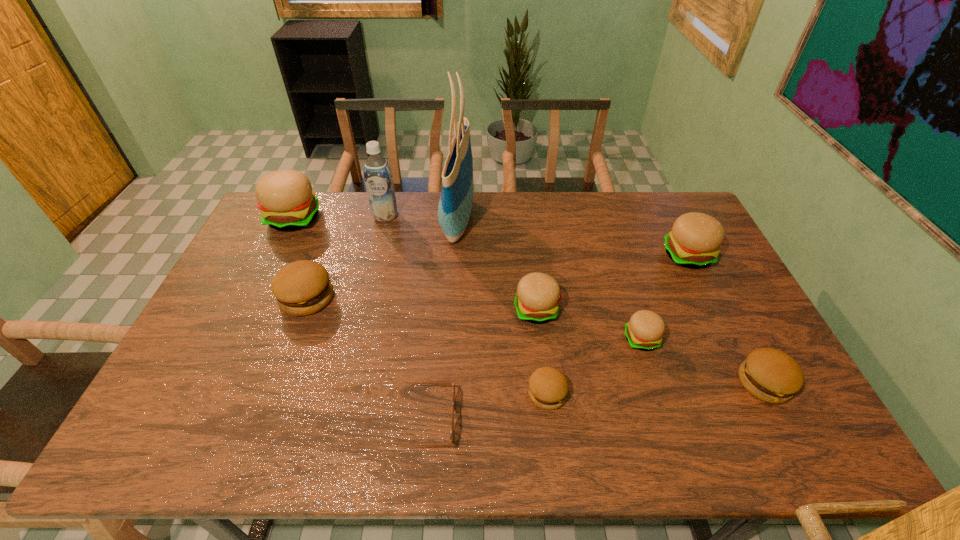
You are a GUI agent. You are given a task and a screenshot of the screen. Output one action in this format:
    pyautogui.click(x=<x>, y=<y>)
    Task: Click on the hamburger positioned at the far edge
    The width and height of the screenshot is (960, 540).
    Given the screenshot: What is the action you would take?
    pyautogui.click(x=286, y=201)

The width and height of the screenshot is (960, 540). I want to click on object present at the near edge, so click(x=437, y=383).

You are a GUI agent. You are given a task and a screenshot of the screen. Output one action in this format:
    pyautogui.click(x=<x>, y=<y>)
    Task: Click on the object present at the left edge
    The height and width of the screenshot is (540, 960).
    Given the screenshot: What is the action you would take?
    pyautogui.click(x=286, y=201)

Where is `object at the far left corner`? Image resolution: width=960 pixels, height=540 pixels. object at the far left corner is located at coordinates (286, 201).

Locate an element on the screen. vacant space at the far edge is located at coordinates (521, 224).

You are a GUI agent. You are given a task and a screenshot of the screen. Output one action in this format:
    pyautogui.click(x=<x>, y=<y>)
    Task: Click on the vacant space at the near edge
    This screenshot has width=960, height=540.
    Given the screenshot: What is the action you would take?
    pyautogui.click(x=665, y=443)

In the image, there is a desktop. Where is `vacant space at the left edge`? vacant space at the left edge is located at coordinates (190, 363).

The height and width of the screenshot is (540, 960). I want to click on vacant space at the right edge of the desktop, so click(712, 300).

Image resolution: width=960 pixels, height=540 pixels. I want to click on empty location between the soya milk and the tallest object, so click(x=421, y=218).

This screenshot has height=540, width=960. I want to click on vacant space that is in between the third hamburger from right to left and the second beige hamburger from left to right, so click(x=588, y=325).